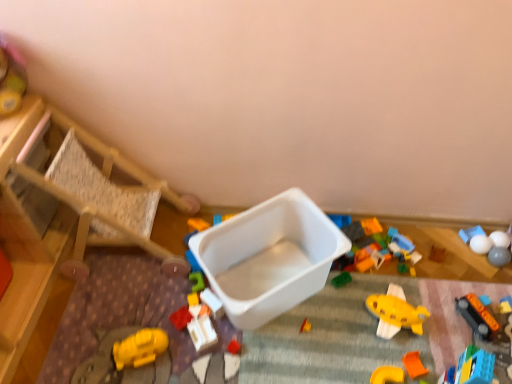
Where is `vacant space in between yellow matte airplane at center, which appears as the 7th toy when viewed from the left, and white plastic container at center, the third toy viewed from the left`? This screenshot has width=512, height=384. vacant space in between yellow matte airplane at center, which appears as the 7th toy when viewed from the left, and white plastic container at center, the third toy viewed from the left is located at coordinates (315, 331).